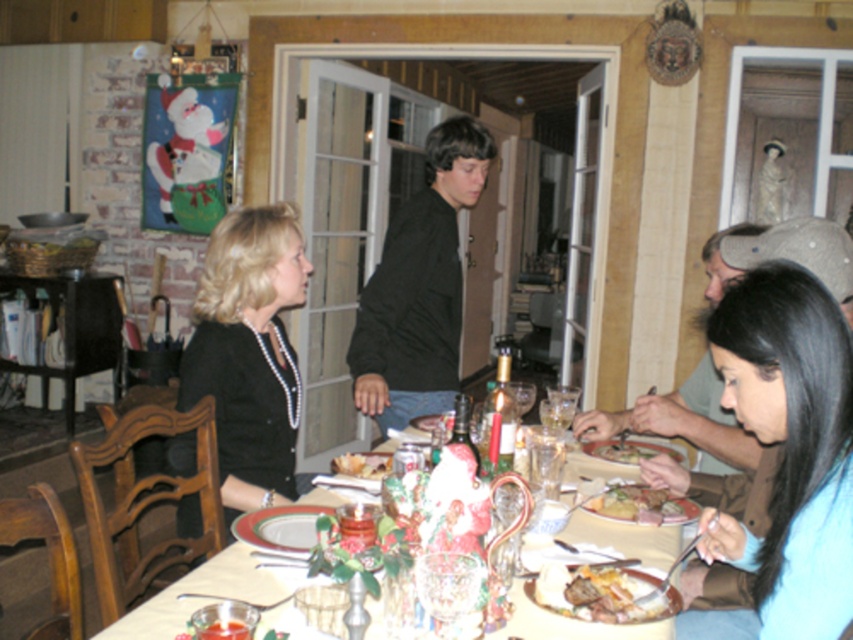
In the scene shown: Does shiny glass table at center have a greater width compared to green leafy salad at lower center?

Yes.

Which is behind, point (238, 576) or point (651, 456)?

The point (651, 456) is more distant.

Where is `shiny glass table at center`? shiny glass table at center is located at coordinates (198, 600).

Is porcelain plate at center thinner than green leafy salad at lower center?

Yes, porcelain plate at center is thinner than green leafy salad at lower center.

Who is taller, porcelain plate at center or green leafy salad at lower center?

With more height is porcelain plate at center.

You are a GUI agent. You are given a task and a screenshot of the screen. Output one action in this format:
    pyautogui.click(x=<x>, y=<y>)
    Task: Click on the porcelain plate at center
    The width and height of the screenshot is (853, 640).
    Given the screenshot: What is the action you would take?
    pyautogui.click(x=280, y=528)

Is black silk shirt at lower right further to the viewer compared to golden brown meat at lower right?

No, it is in front of golden brown meat at lower right.

You are a GUI agent. You are given a task and a screenshot of the screen. Output one action in this format:
    pyautogui.click(x=<x>, y=<y>)
    Task: Click on the black silk shirt at lower right
    This screenshot has height=640, width=853.
    Given the screenshot: What is the action you would take?
    pyautogui.click(x=785, y=458)

Image resolution: width=853 pixels, height=640 pixels. Identify the location of black silk shirt at lower right. (785, 458).